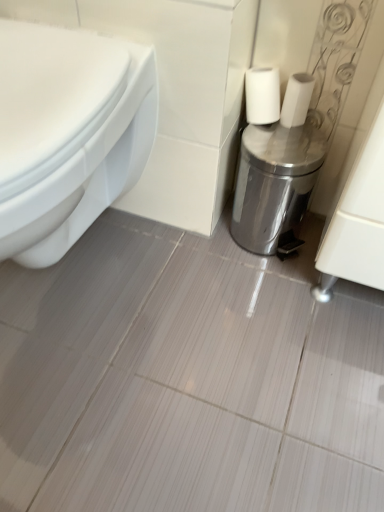
Measure the distance between silver metallic trash can at right and camera.

The distance of silver metallic trash can at right from camera is 32.65 inches.

This screenshot has width=384, height=512. What do you see at coordinates (296, 100) in the screenshot? I see `white matte toilet paper at center` at bounding box center [296, 100].

Locate an element on the screen. This screenshot has height=512, width=384. silver metallic trash can at right is located at coordinates (274, 183).

Looking at this image, considering the positions of objects white matte toilet paper at center and silver metallic trash can at right in the image provided, who is behind, white matte toilet paper at center or silver metallic trash can at right?

white matte toilet paper at center.

Where is `dispenser on the left of the white matte toilet paper at center`? The width and height of the screenshot is (384, 512). dispenser on the left of the white matte toilet paper at center is located at coordinates (274, 183).

From the picture: Which point is more distant from viewer, (x=296, y=106) or (x=284, y=192)?

Positioned behind is point (x=284, y=192).

Does white matte toilet paper at center have a larger size compared to silver metallic trash can at right?

No.

At what (x,y) coordinates should I click in order to perform the action: click on toilet paper on the right of silver metallic trash can at right. Please return your answer as a coordinate pair (x, y). The width and height of the screenshot is (384, 512). Looking at the image, I should click on (296, 100).

Is silver metallic trash can at right aimed at white matte toilet paper at center?

No, silver metallic trash can at right is not oriented towards white matte toilet paper at center.

Is silver metallic trash can at right at the right side of white matte toilet paper at center?

In fact, silver metallic trash can at right is to the left of white matte toilet paper at center.

Is there a large distance between silver metallic trash can at right and white matte toilet paper at center?

No.

Is white matte toilet paper at center in contact with white glossy toilet at left?

No, white matte toilet paper at center is not beside white glossy toilet at left.

From the image's perspective, which is above, white matte toilet paper at center or white glossy toilet at left?

white matte toilet paper at center.

Is white matte toilet paper at center looking in the opposite direction of white glossy toilet at left?

No, white matte toilet paper at center is not facing away from white glossy toilet at left.

Is the depth of white matte toilet paper at center less than that of white glossy toilet at left?

That is False.

Considering the sizes of objects silver metallic trash can at right and white glossy toilet at left in the image provided, who is shorter, silver metallic trash can at right or white glossy toilet at left?

With less height is silver metallic trash can at right.

Consider the image. Is silver metallic trash can at right oriented away from white glossy toilet at left?

No.

Identify the location of dispenser above the white glossy toilet at left (from the image's perspective). (274, 183).

Is point (2, 137) closer or farther from the camera than point (269, 156)?

Point (2, 137) is positioned closer to the camera compared to point (269, 156).

Looking at this image, is white glossy toilet at left next to silver metallic trash can at right?

No, white glossy toilet at left is not beside silver metallic trash can at right.

Is white glossy toilet at left not within silver metallic trash can at right?

Indeed, white glossy toilet at left is completely outside silver metallic trash can at right.

I want to click on toilet that appears below the silver metallic trash can at right (from the image's perspective), so click(x=68, y=133).

Considering the sizes of objects white glossy toilet at left and white matte toilet paper at center in the image provided, who is thinner, white glossy toilet at left or white matte toilet paper at center?

Thinner between the two is white matte toilet paper at center.

Is white glossy toilet at left further to camera compared to white matte toilet paper at center?

No, it is in front of white matte toilet paper at center.

Which of these two, white glossy toilet at left or white matte toilet paper at center, is bigger?

Bigger between the two is white glossy toilet at left.

Is white glossy toilet at left positioned with its back to white matte toilet paper at center?

white glossy toilet at left is not turned away from white matte toilet paper at center.

The width and height of the screenshot is (384, 512). Identify the location of toilet paper on the right of silver metallic trash can at right. (296, 100).

Locate an element on the screen. dispenser in front of the white matte toilet paper at center is located at coordinates (274, 183).

In the scene shown: Looking at the image, which one is located closer to silver metallic trash can at right, white matte toilet paper at center or white glossy toilet at left?

white matte toilet paper at center lies closer to silver metallic trash can at right than the other object.

Estimate the real-world distances between objects in this image. Which object is closer to white glossy toilet at left, white matte toilet paper at center or silver metallic trash can at right?

Among the two, silver metallic trash can at right is located nearer to white glossy toilet at left.

Based on their spatial positions, is silver metallic trash can at right or white glossy toilet at left further from white matte toilet paper at center?

The object further to white matte toilet paper at center is white glossy toilet at left.

Estimate the real-world distances between objects in this image. Which object is further from white glossy toilet at left, silver metallic trash can at right or white matte toilet paper at center?

Among the two, white matte toilet paper at center is located further to white glossy toilet at left.

In the scene shown: When comparing their distances from silver metallic trash can at right, does white glossy toilet at left or white matte toilet paper at center seem further?

white glossy toilet at left lies further to silver metallic trash can at right than the other object.

Considering their positions, is white glossy toilet at left positioned closer to white matte toilet paper at center than silver metallic trash can at right?

The object closer to white matte toilet paper at center is silver metallic trash can at right.

This screenshot has width=384, height=512. In order to click on dispenser situated between white glossy toilet at left and white matte toilet paper at center from left to right in this screenshot , I will do `click(274, 183)`.